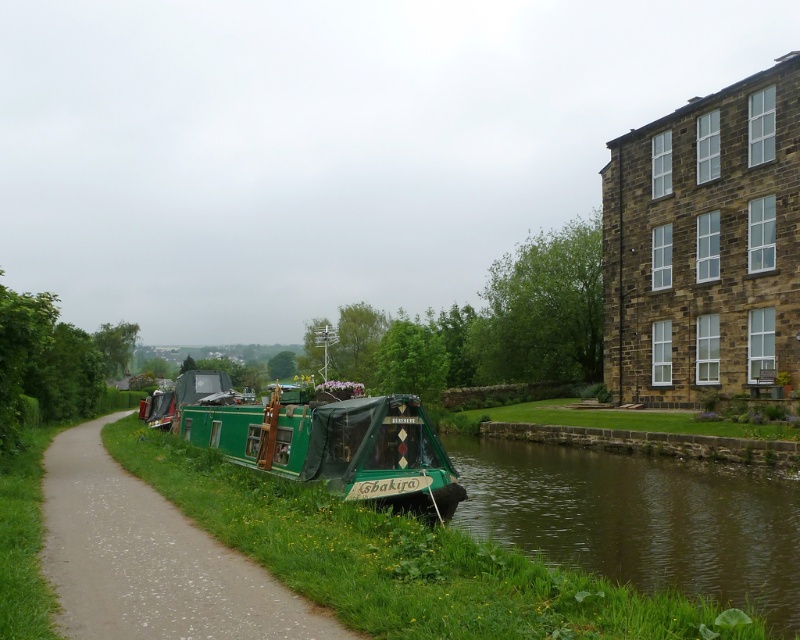
Question: From the image, what is the correct spatial relationship of green canvas boat at center in relation to green canvas barge at center?

Choices:
 (A) above
 (B) below

Answer: (B)

Question: Which object is farther from the camera taking this photo?

Choices:
 (A) green canvas boat at center
 (B) green grassy river at lower right
 (C) green canvas barge at center

Answer: (C)

Question: Which object is the farthest from the green canvas boat at center?

Choices:
 (A) green canvas barge at center
 (B) green grassy river at lower right

Answer: (B)

Question: Considering the relative positions of green canvas boat at center and green canvas barge at center in the image provided, where is green canvas boat at center located with respect to green canvas barge at center?

Choices:
 (A) above
 (B) below

Answer: (B)

Question: Which point is closer to the camera?

Choices:
 (A) (294, 614)
 (B) (784, 563)

Answer: (A)

Question: Is green grassy river at lower right bigger than green canvas boat at center?

Choices:
 (A) no
 (B) yes

Answer: (B)